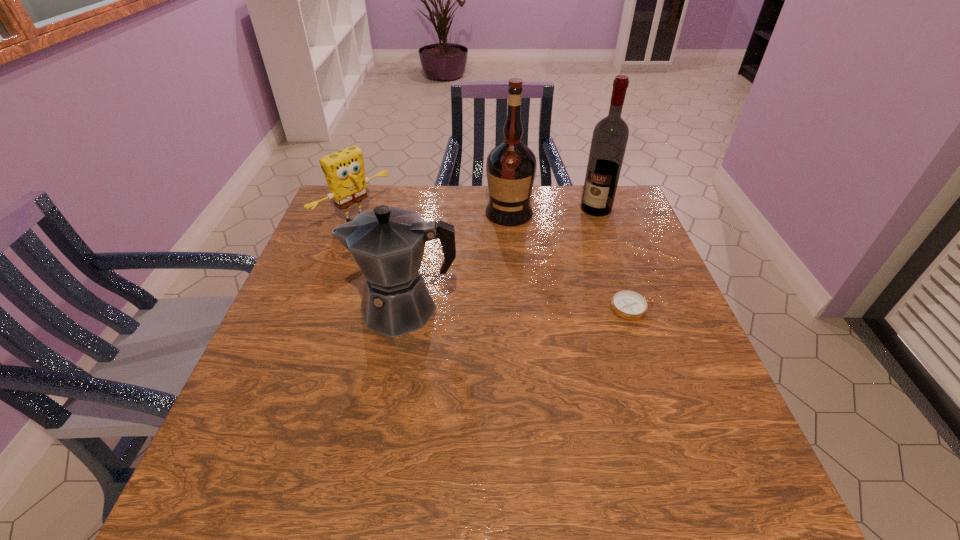
In the image, there is a desktop. Where is `free space at the far left corner`? Image resolution: width=960 pixels, height=540 pixels. free space at the far left corner is located at coordinates (333, 214).

In order to click on vacant point at the near left corner in this screenshot , I will do `click(248, 449)`.

The height and width of the screenshot is (540, 960). In order to click on blank space at the far right corner in this screenshot , I will do `click(625, 195)`.

Where is `unoccupied position between the fourth tallest object and the alcohol`? Image resolution: width=960 pixels, height=540 pixels. unoccupied position between the fourth tallest object and the alcohol is located at coordinates (475, 213).

The width and height of the screenshot is (960, 540). What are the coordinates of `vacant area between the alcohol and the fourth tallest object` in the screenshot? It's located at (475, 213).

In order to click on free spot between the coffeepot and the compass in this screenshot , I will do `click(519, 308)`.

Locate an element on the screen. The image size is (960, 540). vacant area between the compass and the liquor is located at coordinates (571, 260).

Find the location of a particular element. This screenshot has width=960, height=540. empty space between the sponge and the shortest object is located at coordinates (494, 263).

The width and height of the screenshot is (960, 540). I want to click on vacant region between the third tallest object and the shortest object, so click(x=519, y=308).

Identify the location of object that is the fourth closest to the third object from left to right. (627, 304).